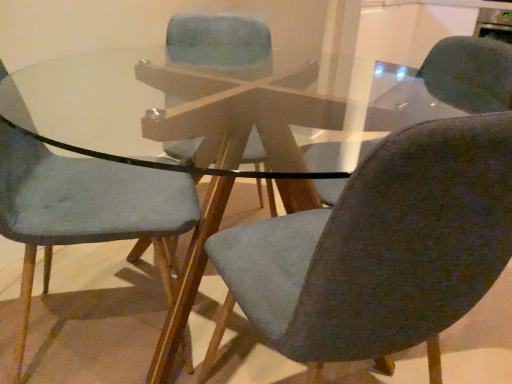
Question: From the image's perspective, is textured gray chair at center, marked as the 1th chair in a right-to-left arrangement, positioned above or below textured fabric chair at center, marked as the 2th chair in a right-to-left arrangement?

Choices:
 (A) above
 (B) below

Answer: (B)

Question: Is textured gray chair at center, marked as the 1th chair in a right-to-left arrangement, in front of or behind textured fabric chair at center, placed as the second chair when sorted from left to right, in the image?

Choices:
 (A) behind
 (B) front

Answer: (B)

Question: Which object is positioned farthest from the textured fabric chair at center, marked as the 2th chair in a right-to-left arrangement?

Choices:
 (A) textured gray chair at center, the third chair in the left-to-right sequence
 (B) matte gray chair at left, the 1th chair positioned from the left

Answer: (A)

Question: Estimate the real-world distances between objects in this image. Which object is farther from the matte gray chair at left, the 3th chair from the right?

Choices:
 (A) textured gray chair at center, marked as the 1th chair in a right-to-left arrangement
 (B) textured fabric chair at center, marked as the 2th chair in a right-to-left arrangement

Answer: (B)